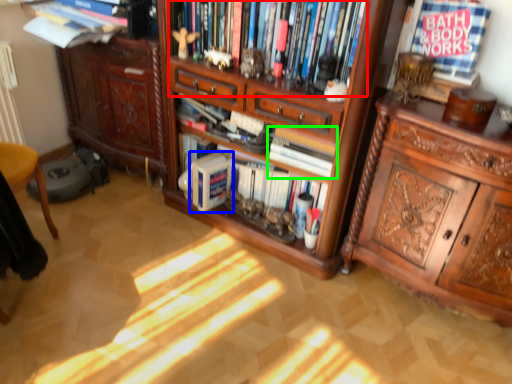
Question: Considering the real-world distances, which object is closest to book (highlighted by a red box)? book (highlighted by a blue box) or book (highlighted by a green box).

Choices:
 (A) book
 (B) book

Answer: (B)